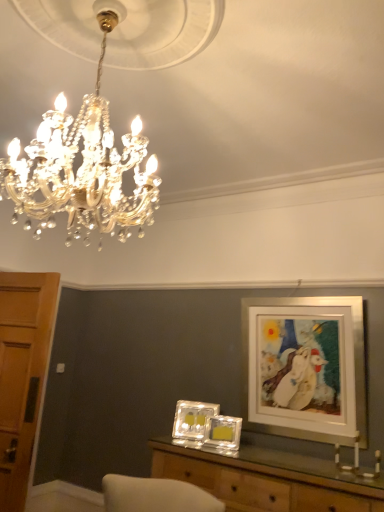
Where is `free space above white matte picture frame at upper right, the 3th picture frame viewed from the left (from a real-world perspective)`? free space above white matte picture frame at upper right, the 3th picture frame viewed from the left (from a real-world perspective) is located at coordinates pyautogui.click(x=298, y=298).